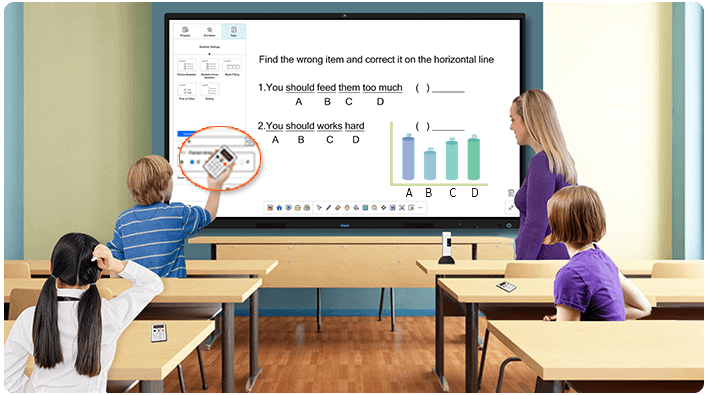
What are the coordinates of `floor` in the screenshot? It's located at (293, 380).